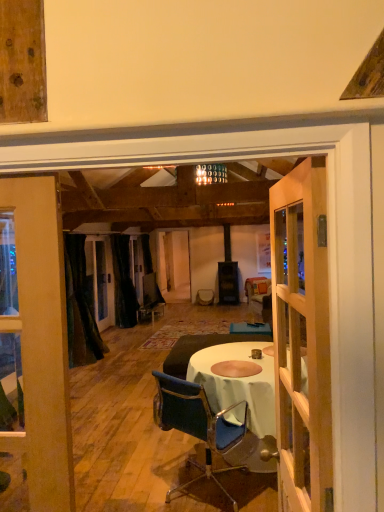
Locate an element on the screen. free space below blue fabric chair at center (from a real-world perspective) is located at coordinates (210, 489).